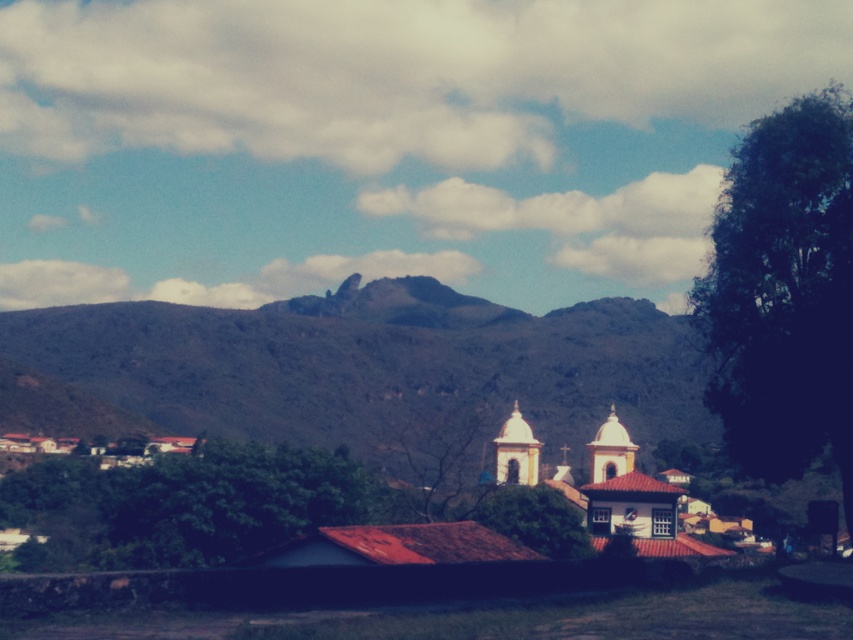
You are standing at the base of the mountain looking towards the buildings. There are two points marked in the image. The first point is at coordinate (788, 179) and the second is at (691, 536). Which point is closer to you?

Point (788, 179) is in front of point (691, 536), so it is closer to you.

You are standing in the lush green area and want to walk towards the green leafy tree at right. Which direction should you head to avoid the green grassy mountain at center?

You should head to the right side to avoid the green grassy mountain at center, as it is positioned on the left side of the green leafy tree at right.

You are standing at the base of the green grassy mountain at center and want to reach the green leafy tree at right. Which direction should you move to get closer to the tree?

The green grassy mountain at center is below the green leafy tree at right, so you should move upward to reach the tree.